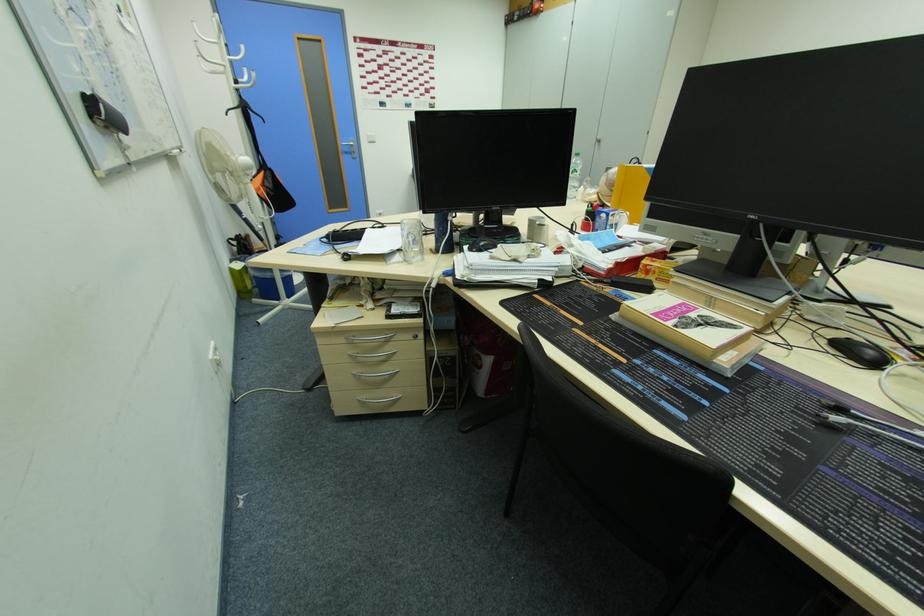
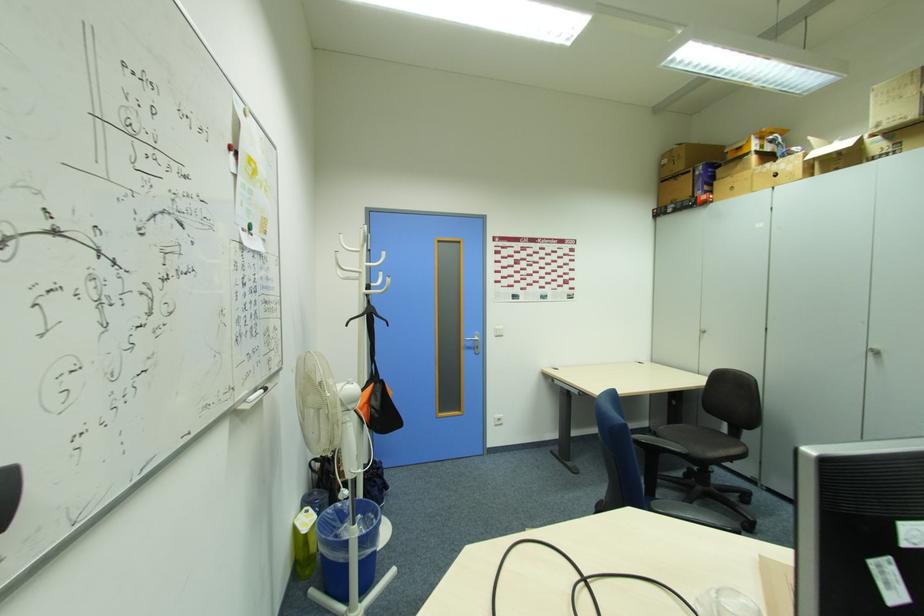
In the second image, find the point that corresponds to (x=349, y=151) in the first image.

(472, 346)